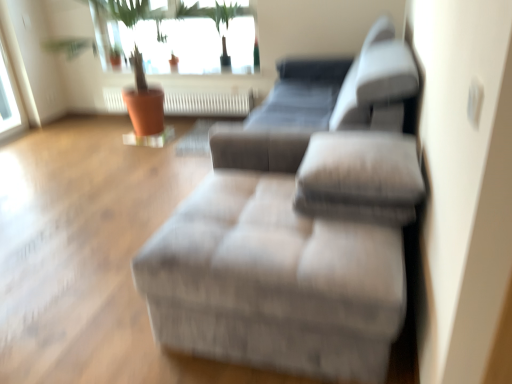
Question: Is silver metallic radiator at center surrounding white glass window at upper left, which is the 2th window from right to left?

Choices:
 (A) yes
 (B) no

Answer: (B)

Question: From a real-world perspective, is silver metallic radiator at center over white glass window at upper left, which is the 2th window from right to left?

Choices:
 (A) no
 (B) yes

Answer: (A)

Question: Is silver metallic radiator at center placed right next to white glass window at upper left, which is the 2th window from right to left?

Choices:
 (A) no
 (B) yes

Answer: (A)

Question: Can you confirm if silver metallic radiator at center is shorter than white glass window at upper left, which ranks as the 1th window in left-to-right order?

Choices:
 (A) no
 (B) yes

Answer: (B)

Question: Is the depth of silver metallic radiator at center less than that of white glass window at upper left, which is the 2th window from right to left?

Choices:
 (A) no
 (B) yes

Answer: (A)

Question: Considering the positions of silver metallic radiator at center and white glass window at upper left, which is the 2th window from right to left, in the image, is silver metallic radiator at center taller or shorter than white glass window at upper left, which is the 2th window from right to left,?

Choices:
 (A) tall
 (B) short

Answer: (B)

Question: Considering the positions of silver metallic radiator at center and white glass window at upper left, which is the 2th window from right to left, in the image, is silver metallic radiator at center wider or thinner than white glass window at upper left, which is the 2th window from right to left,?

Choices:
 (A) wide
 (B) thin

Answer: (A)

Question: Visually, is silver metallic radiator at center positioned to the left or to the right of white glass window at upper left, which is the 2th window from right to left?

Choices:
 (A) right
 (B) left

Answer: (A)

Question: From a real-world perspective, relative to white glass window at upper left, which ranks as the 1th window in left-to-right order, is silver metallic radiator at center vertically above or below?

Choices:
 (A) above
 (B) below

Answer: (B)

Question: Looking at the image, does transparent glass window at upper center, which ranks as the second window in left-to-right order, seem bigger or smaller compared to textured gray ottoman at center?

Choices:
 (A) small
 (B) big

Answer: (A)

Question: In terms of height, does transparent glass window at upper center, which ranks as the second window in left-to-right order, look taller or shorter compared to textured gray ottoman at center?

Choices:
 (A) short
 (B) tall

Answer: (B)

Question: From the image's perspective, is transparent glass window at upper center, which ranks as the second window in left-to-right order, positioned above or below textured gray ottoman at center?

Choices:
 (A) below
 (B) above

Answer: (B)

Question: Does point (226, 52) appear closer or farther from the camera than point (329, 203)?

Choices:
 (A) closer
 (B) farther

Answer: (B)

Question: Looking at the image, does textured gray ottoman at center seem bigger or smaller compared to silver metallic radiator at center?

Choices:
 (A) small
 (B) big

Answer: (B)

Question: Is textured gray ottoman at center taller or shorter than silver metallic radiator at center?

Choices:
 (A) tall
 (B) short

Answer: (A)